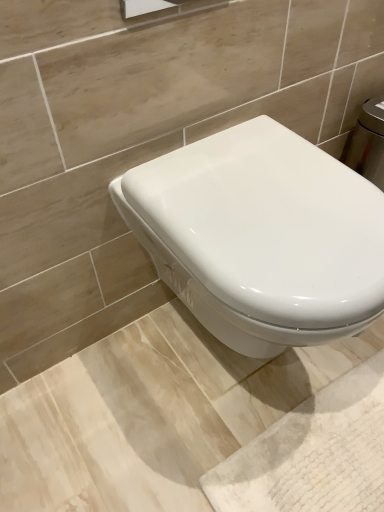
Find the location of a particular element. white glossy toilet at center is located at coordinates (261, 236).

This screenshot has width=384, height=512. What do you see at coordinates (261, 236) in the screenshot? I see `white glossy toilet at center` at bounding box center [261, 236].

The image size is (384, 512). Find the location of `white glossy toilet at center`. white glossy toilet at center is located at coordinates (261, 236).